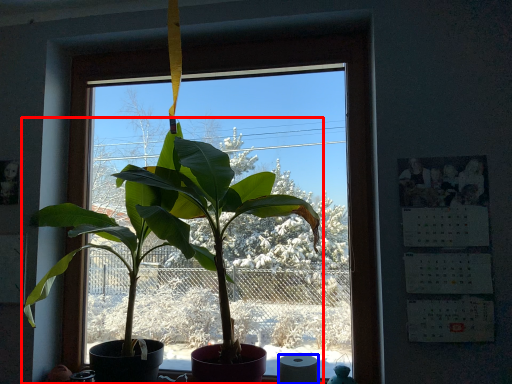
Question: Which point is closer to the camera, houseplant (highlighted by a red box) or toilet paper (highlighted by a blue box)?

Choices:
 (A) houseplant
 (B) toilet paper

Answer: (A)